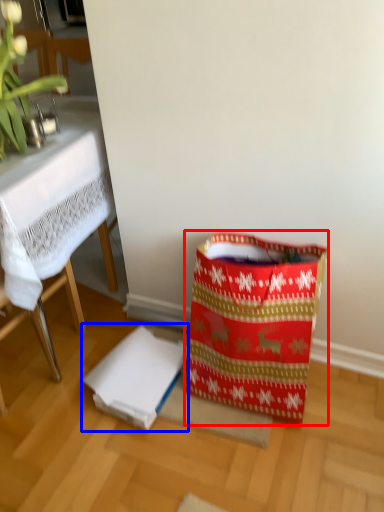
Question: Which of the following is the farthest to the observer, shopping bag (highlighted by a red box) or cardboard box (highlighted by a blue box)?

Choices:
 (A) shopping bag
 (B) cardboard box

Answer: (B)